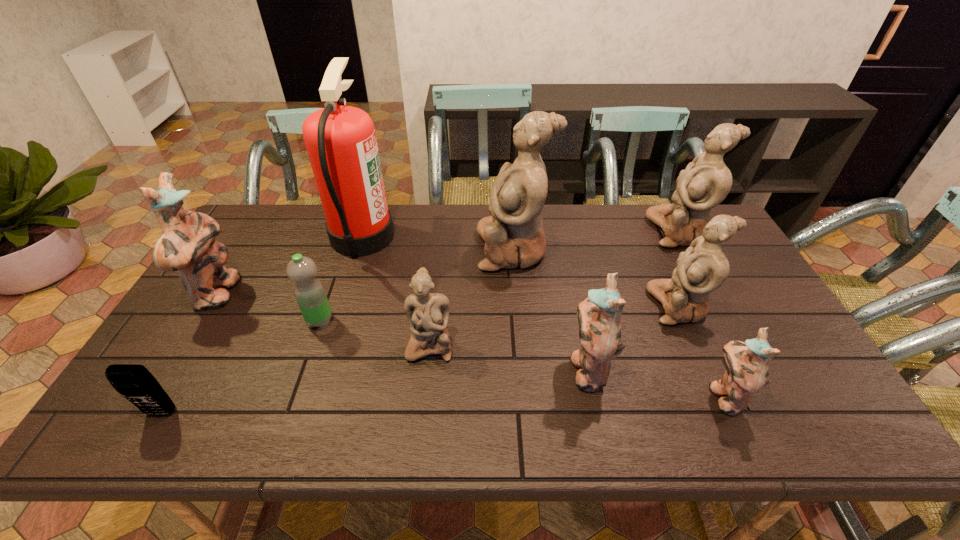
At what (x,y) coordinates should I click in order to perform the action: click on fire extinguisher. Please return your answer as a coordinate pair (x, y). The height and width of the screenshot is (540, 960). Looking at the image, I should click on (341, 143).

The image size is (960, 540). Identify the location of the tallest figurine. (514, 237).

The image size is (960, 540). I want to click on the second white figurine from left to right, so click(x=514, y=237).

At what (x,y) coordinates should I click in order to perform the action: click on the third smallest white figurine. Please return your answer as a coordinate pair (x, y). This screenshot has height=540, width=960. Looking at the image, I should click on (706, 181).

Identify the location of the leftmost figurine. (187, 244).

I want to click on the farthest pink figurine, so click(187, 244).

At what (x,y) coordinates should I click in order to perform the action: click on the second smallest pink figurine. Please return your answer as a coordinate pair (x, y). Looking at the image, I should click on tap(598, 316).

Identify the location of the third biggest white figurine. The image size is (960, 540). tap(703, 267).

Find the location of a particular element. The height and width of the screenshot is (540, 960). green water bottle is located at coordinates (309, 292).

This screenshot has width=960, height=540. What are the coordinates of `the smallest white figurine` in the screenshot? It's located at (428, 313).